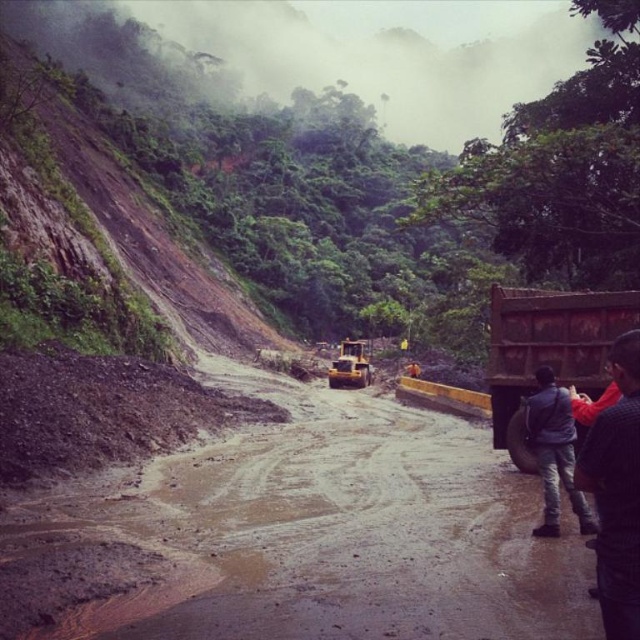
Does brown rocky hillside at upper left lie behind dark gray jeans at lower right?

Yes, it is.

How distant is brown rocky hillside at upper left from dark gray jeans at lower right?

→ brown rocky hillside at upper left is 138.32 feet away from dark gray jeans at lower right.

Identify the location of brown rocky hillside at upper left. (141, 225).

Between brown muddy dirt track at center and brown rocky hillside at upper left, which one has less height?

brown muddy dirt track at center

Is brown muddy dirt track at center closer to the viewer compared to brown rocky hillside at upper left?

Yes.

At what (x,y) coordinates should I click in order to perform the action: click on brown muddy dirt track at center. Please return your answer as a coordinate pair (x, y). Image resolution: width=640 pixels, height=640 pixels. Looking at the image, I should click on (321, 531).

Locate an element on the screen. brown muddy dirt track at center is located at coordinates (321, 531).

Who is positioned more to the right, dark gray sweater at lower right or dark gray jeans at lower right?

Positioned to the right is dark gray jeans at lower right.

Where is `dark gray sweater at lower right`? The image size is (640, 640). dark gray sweater at lower right is located at coordinates (616, 492).